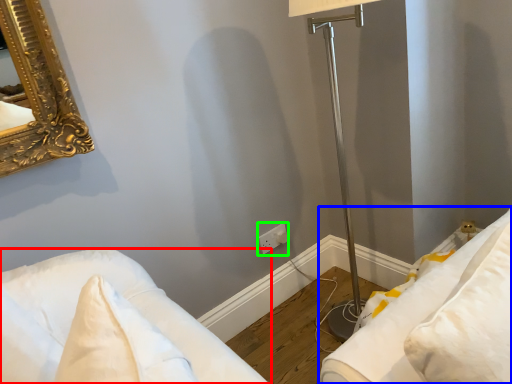
Question: Based on their relative distances, which object is nearer to furniture (highlighted by a red box)? Choose from furniture (highlighted by a blue box) and electric outlet (highlighted by a green box).

Choices:
 (A) furniture
 (B) electric outlet

Answer: (A)